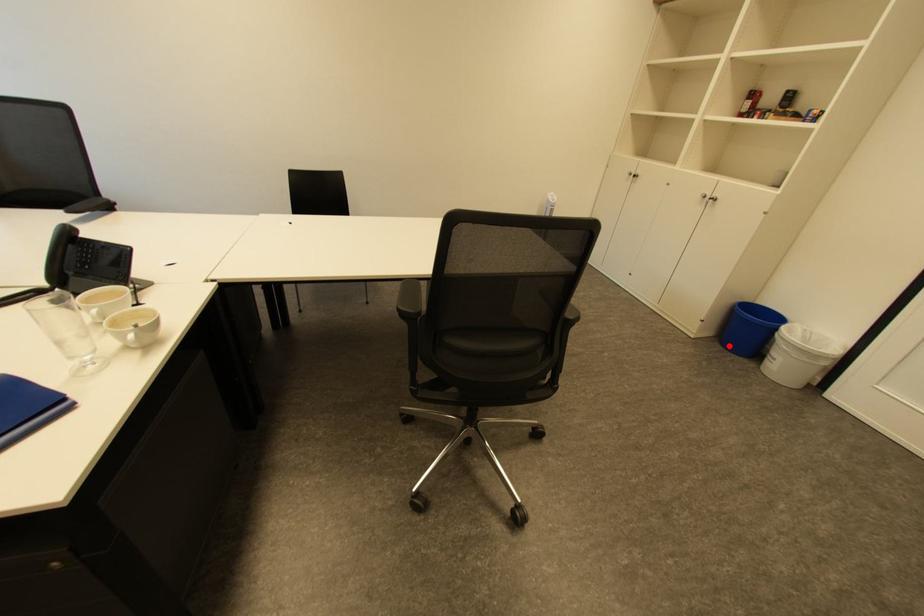
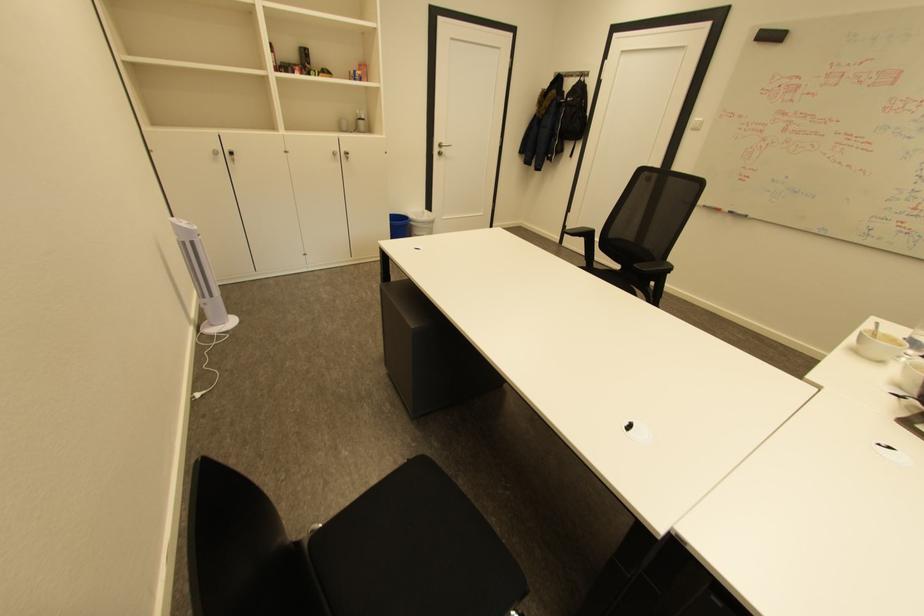
Question: I am providing you with two images of the same scene from different viewpoints. A red point is marked on the first image. Can you still see the location of the red point in image 2?

Choices:
 (A) Yes
 (B) No

Answer: (B)